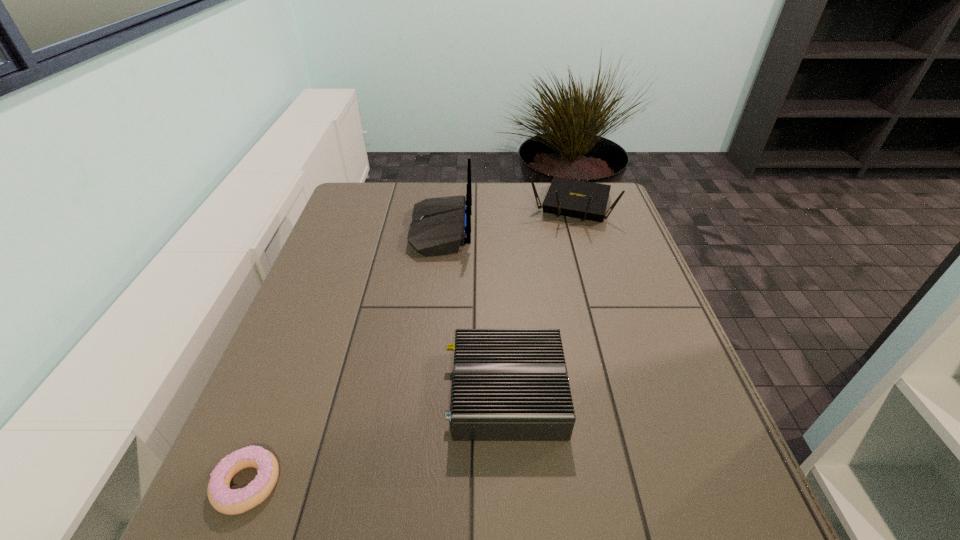
Image resolution: width=960 pixels, height=540 pixels. I want to click on the tallest object, so click(439, 226).

What are the coordinates of `the second shortest router` in the screenshot? It's located at (585, 200).

Find the location of a particular element. The width and height of the screenshot is (960, 540). the shortest router is located at coordinates (508, 384).

Where is `the nearest router`? The image size is (960, 540). the nearest router is located at coordinates (508, 384).

Find the location of `doughnut`. doughnut is located at coordinates (223, 499).

Where is `the shortest object`? the shortest object is located at coordinates pyautogui.click(x=223, y=499).

This screenshot has height=540, width=960. Identify the location of vacant region located 0.090m on the back of the tallest object. (501, 231).

Find the location of a particular element. vacant region located on the left of the second tallest router is located at coordinates (503, 206).

This screenshot has width=960, height=540. What are the coordinates of `free space located 0.380m on the back panel of the shortest router` in the screenshot? It's located at (262, 393).

In order to click on vacant region located on the back panel of the shortest router in this screenshot , I will do point(335,393).